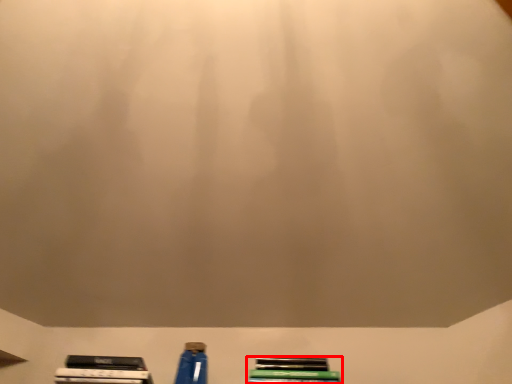
Question: Observing the image, what is the correct spatial positioning of book (annotated by the red box) in reference to bottle?

Choices:
 (A) right
 (B) left

Answer: (A)